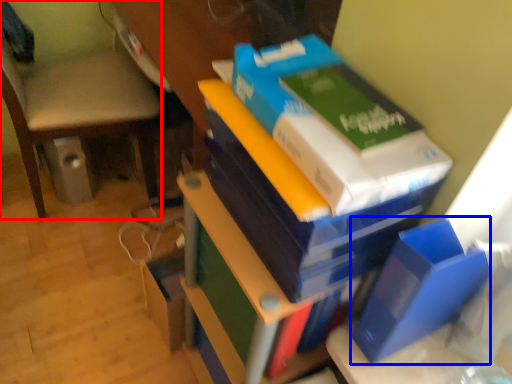
Question: Which point is closer to the camera, chair (highlighted by a red box) or paperback book (highlighted by a blue box)?

Choices:
 (A) chair
 (B) paperback book

Answer: (B)